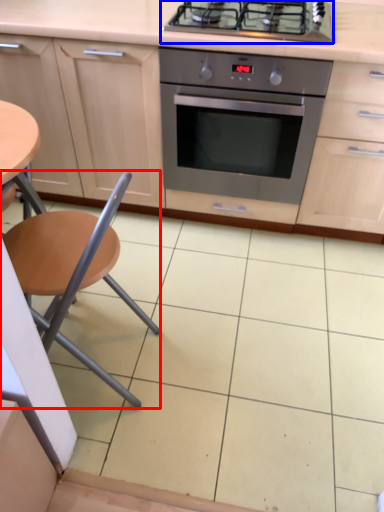
Question: Which of the following is the farthest to the observer, chair (highlighted by a red box) or gas stove (highlighted by a blue box)?

Choices:
 (A) chair
 (B) gas stove

Answer: (B)